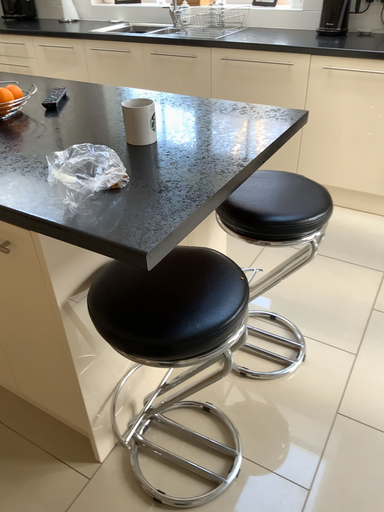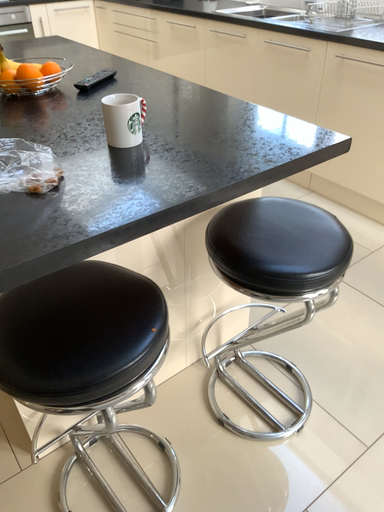
Question: Which way did the camera rotate in the video?

Choices:
 (A) rotated left
 (B) rotated right

Answer: (A)